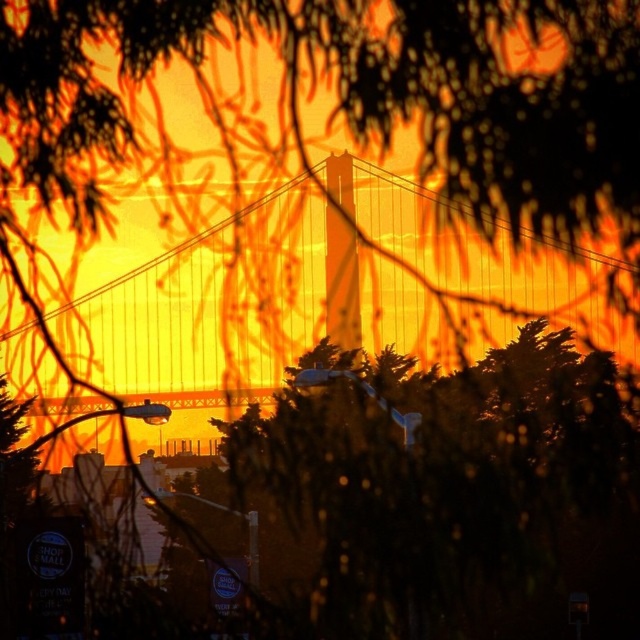
You are an artist sketching the sunset scene. You want to draw the dark green leafy tree at center and the metallic suspension bridge at center. According to the scene, which object is positioned to the right side?

The dark green leafy tree at center is to the right of the metallic suspension bridge at center.

You are an architect designing a new observation deck. You want to ensure visitors have an unobstructed view of the suspension bridge. Given the dark green leafy tree at center, where should you position the observation deck to avoid its branches?

The dark green leafy tree at center is located at point [445,497]. To avoid its branches, position the observation deck away from this coordinate, perhaps to the left or right side of the tree to ensure an unobstructed view of the suspension bridge.